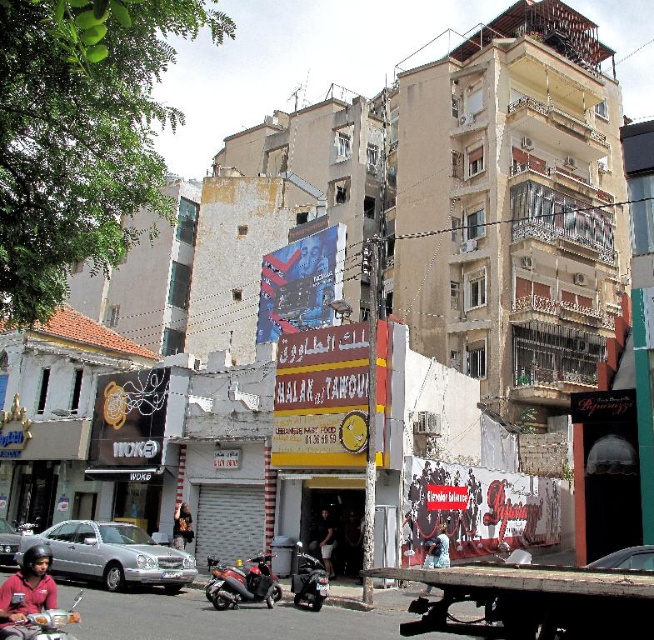
Can you confirm if matte black helmet at lower left is bigger than silver metallic sedan at lower left?

Indeed, matte black helmet at lower left has a larger size compared to silver metallic sedan at lower left.

This screenshot has width=654, height=640. What do you see at coordinates (26, 593) in the screenshot? I see `matte black helmet at lower left` at bounding box center [26, 593].

Locate an element on the screen. This screenshot has height=640, width=654. matte black helmet at lower left is located at coordinates coord(26,593).

Does blue denim jacket at lower center have a lesser height compared to light brown leather jacket at center?

Yes, blue denim jacket at lower center is shorter than light brown leather jacket at center.

Which is behind, point (430, 554) or point (190, 531)?

The point (190, 531) is more distant.

Find the location of a particular element. The image size is (654, 640). blue denim jacket at lower center is located at coordinates (438, 548).

Does silver metallic car at lower left have a greater width compared to silver metallic sedan at lower left?

Indeed, silver metallic car at lower left has a greater width compared to silver metallic sedan at lower left.

Where is `silver metallic car at lower left`? The width and height of the screenshot is (654, 640). silver metallic car at lower left is located at coordinates (111, 556).